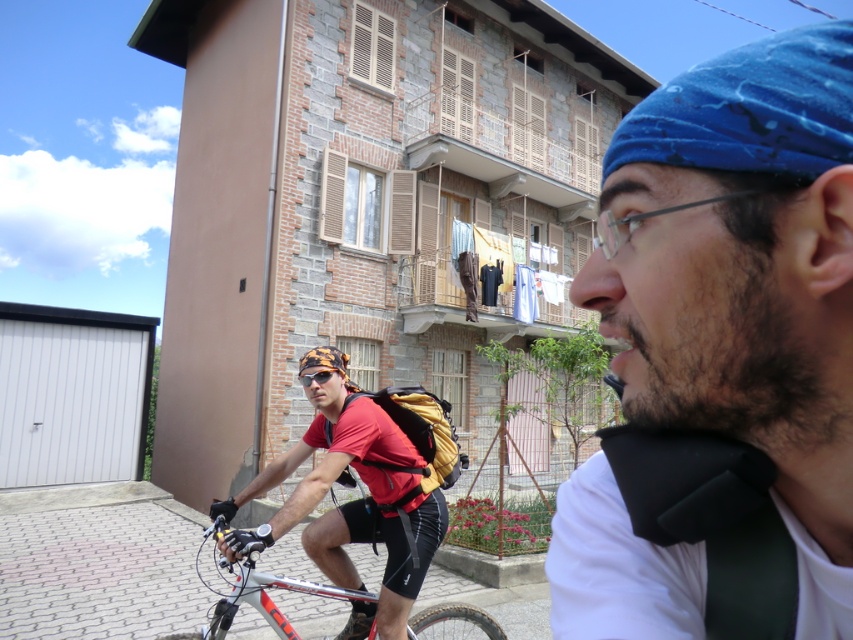
Question: Is blue fabric headband at upper right thinner than shiny orange goggles at center?

Choices:
 (A) yes
 (B) no

Answer: (B)

Question: Which point is closer to the camera taking this photo?

Choices:
 (A) (601, 252)
 (B) (311, 372)
 (C) (421, 616)
 (D) (326, 355)

Answer: (A)

Question: Estimate the real-world distances between objects in this image. Which object is farther from the camouflage fabric helmet at center?

Choices:
 (A) matte red shirt at center
 (B) shiny metallic bicycle at center

Answer: (B)

Question: Is matte red shirt at center wider than shiny metallic bicycle at center?

Choices:
 (A) yes
 (B) no

Answer: (B)

Question: Does blue fabric headband at upper right appear on the left side of camouflage fabric helmet at center?

Choices:
 (A) no
 (B) yes

Answer: (A)

Question: Which of the following is the closest to the observer?

Choices:
 (A) matte red shirt at center
 (B) camouflage fabric helmet at center

Answer: (A)